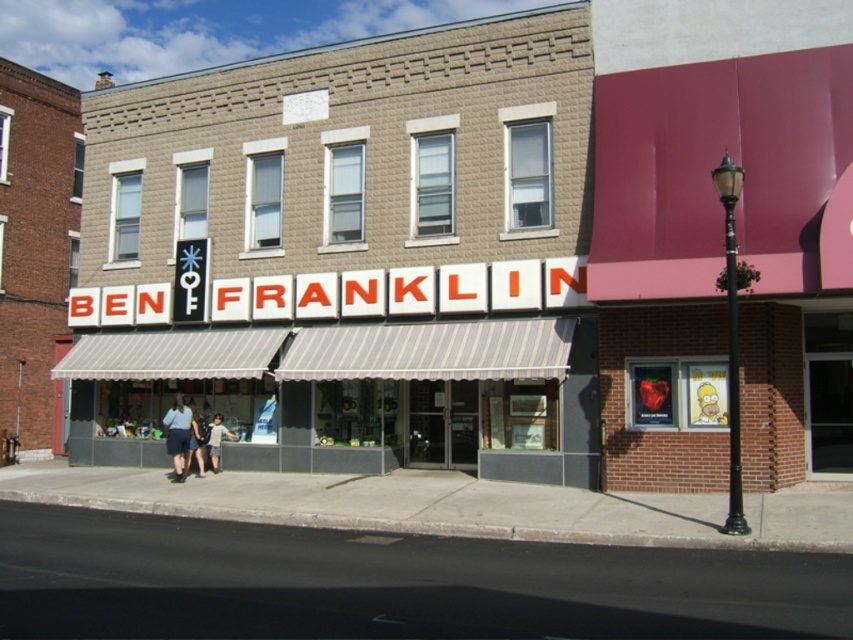
You are a customer looking at the display through the storefront window of Ben Franklin. You see two pairs of denim shorts at lower left and denim shorts at center. Which pair is positioned more to the left side of the window?

The denim shorts at lower left is positioned more to the left side of the window.

You are a customer standing outside the Ben Franklin store looking through the display window. You see two pairs of denim shorts at lower left and denim shorts at center. Which pair is positioned higher up in the window?

The denim shorts at lower left is positioned higher up in the window than the denim shorts at center because it is located above it.